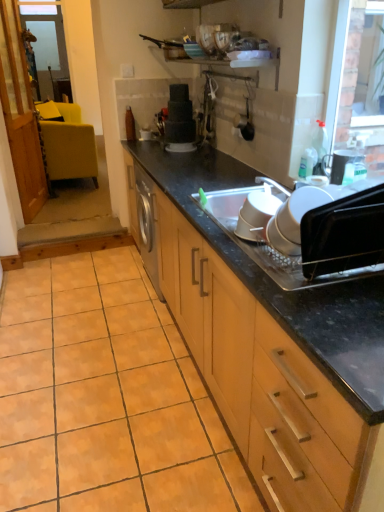
Locate an element on the screen. Image resolution: width=384 pixels, height=512 pixels. free point to the left of black plastic oven at right, the fourth appliance from the top is located at coordinates (277, 288).